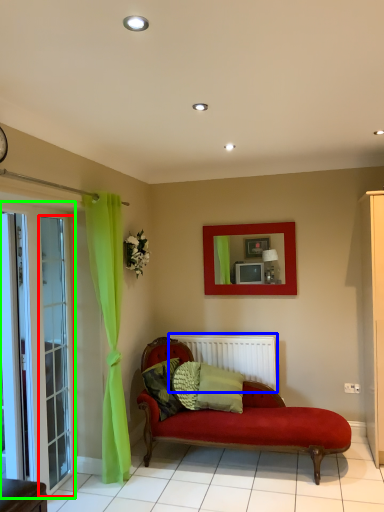
Question: Considering the real-world distances, which object is farthest from glass door (highlighted by a red box)? radiator (highlighted by a blue box) or screen door (highlighted by a green box)?

Choices:
 (A) radiator
 (B) screen door

Answer: (A)